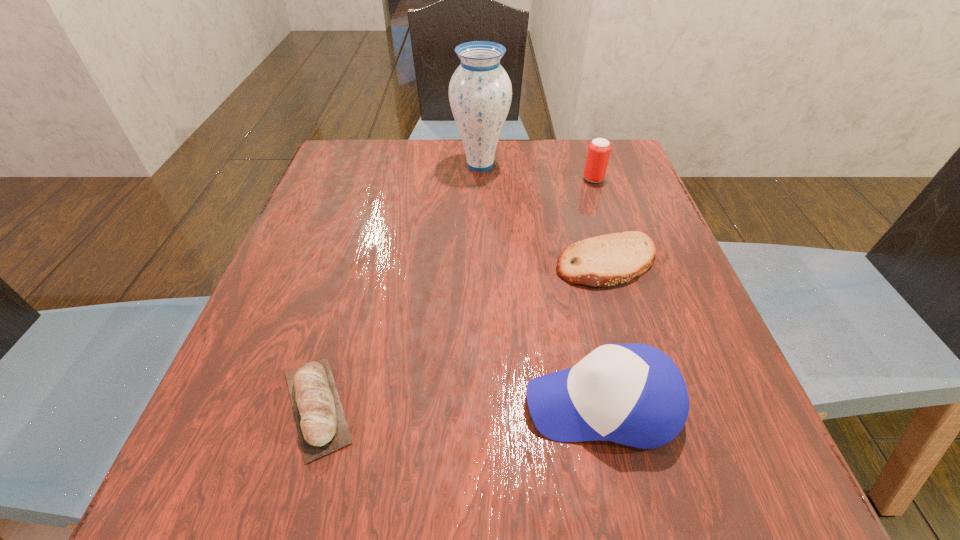
Where is `baseball cap that is at the right edge`? The height and width of the screenshot is (540, 960). baseball cap that is at the right edge is located at coordinates click(x=633, y=394).

Locate an element on the screen. This screenshot has height=540, width=960. pita bread present at the right edge is located at coordinates (607, 260).

This screenshot has width=960, height=540. Identify the location of object at the near left corner. (322, 427).

This screenshot has height=540, width=960. I want to click on object that is at the far right corner, so click(x=599, y=149).

Where is `object situated at the near right corner`? The width and height of the screenshot is (960, 540). object situated at the near right corner is located at coordinates (633, 394).

Find the location of a particular element. The image size is (960, 540). blank area at the far edge is located at coordinates (396, 160).

The height and width of the screenshot is (540, 960). I want to click on vacant space at the near edge of the desktop, so click(x=658, y=510).

Find the location of a particular element. vacant space at the left edge of the desktop is located at coordinates (279, 429).

This screenshot has height=540, width=960. Find the location of `free space at the right edge`. free space at the right edge is located at coordinates pyautogui.click(x=717, y=395).

Image resolution: width=960 pixels, height=540 pixels. In the image, there is a desktop. Identify the location of vacant space at the far left corner. (334, 170).